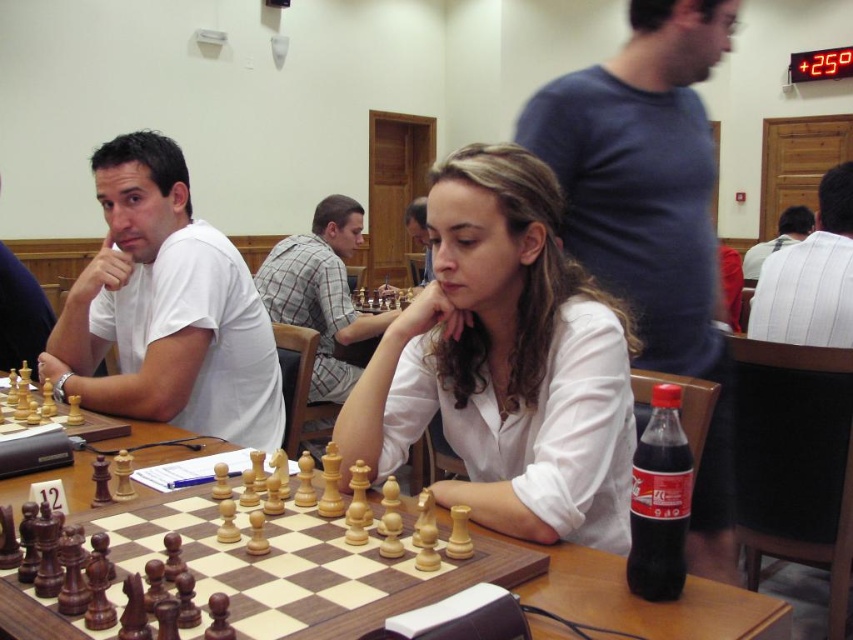
Can you confirm if white matte shirt at center is positioned to the right of white striped shirt at upper right?

Incorrect, white matte shirt at center is not on the right side of white striped shirt at upper right.

What do you see at coordinates (505, 364) in the screenshot? This screenshot has height=640, width=853. I see `white matte shirt at center` at bounding box center [505, 364].

Which is behind, point (386, 456) or point (799, 314)?

Point (799, 314)

Locate an element on the screen. white matte shirt at center is located at coordinates (505, 364).

Describe the element at coordinates (166, 308) in the screenshot. The width and height of the screenshot is (853, 640). I see `white matte shirt at left` at that location.

Does white matte shirt at left appear on the left side of white shirt at center?

Correct, you'll find white matte shirt at left to the left of white shirt at center.

The height and width of the screenshot is (640, 853). What do you see at coordinates (166, 308) in the screenshot?
I see `white matte shirt at left` at bounding box center [166, 308].

Find the location of a particular element. This screenshot has width=853, height=640. white matte shirt at left is located at coordinates [x=166, y=308].

Which of these two, white matte shirt at center or wooden chessboard at center, stands taller?

Standing taller between the two is white matte shirt at center.

Based on the photo, who is positioned more to the right, white matte shirt at center or wooden chessboard at center?

white matte shirt at center

Where is `white matte shirt at center`? The height and width of the screenshot is (640, 853). white matte shirt at center is located at coordinates (505, 364).

Where is `white matte shirt at center`? This screenshot has height=640, width=853. white matte shirt at center is located at coordinates (505, 364).